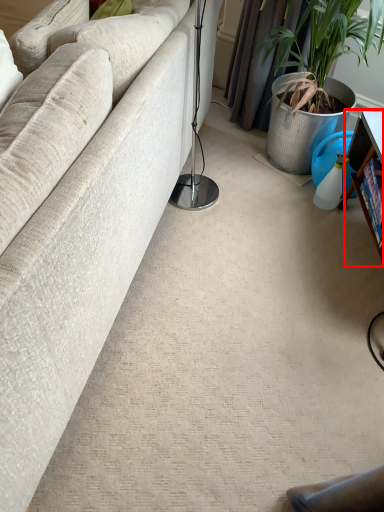
Question: From the image's perspective, considering the relative positions of table (annotated by the red box) and studio couch in the image provided, where is table (annotated by the red box) located with respect to the staircase?

Choices:
 (A) below
 (B) above

Answer: (A)